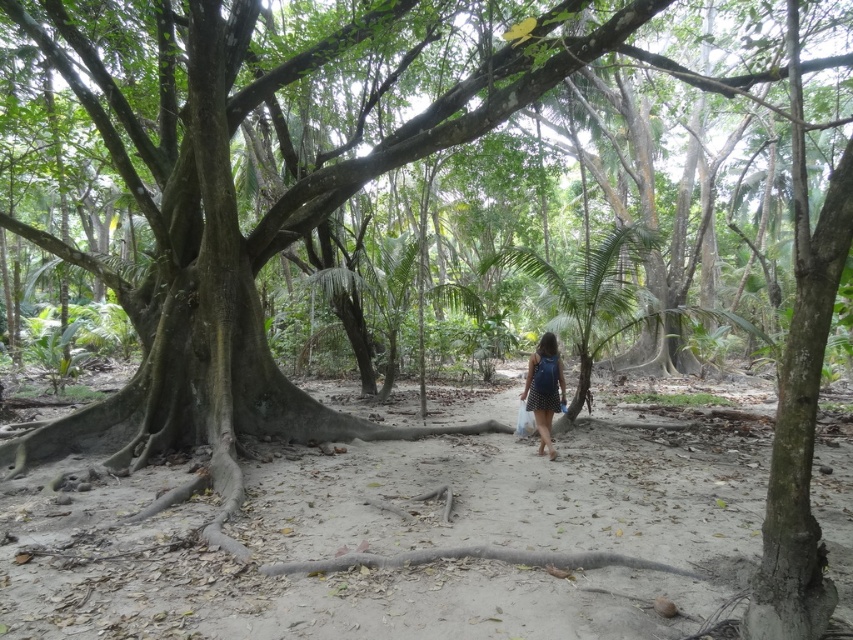
Question: Does dirt path at center appear on the left side of blue denim dress at center?

Choices:
 (A) no
 (B) yes

Answer: (B)

Question: Is dirt path at center smaller than blue denim dress at center?

Choices:
 (A) yes
 (B) no

Answer: (A)

Question: Is dirt path at center to the left of blue denim dress at center from the viewer's perspective?

Choices:
 (A) yes
 (B) no

Answer: (A)

Question: Which point is farther to the camera?

Choices:
 (A) blue denim dress at center
 (B) dirt path at center

Answer: (A)

Question: Which point appears farthest from the camera in this image?

Choices:
 (A) (271, 541)
 (B) (547, 368)

Answer: (B)